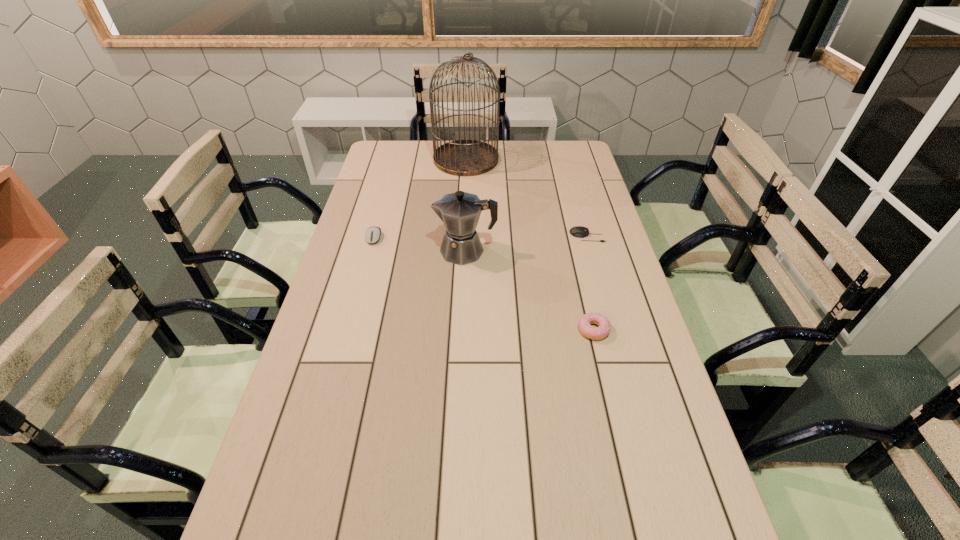
At what (x,y) coordinates should I click in order to perform the action: click on birdcage. Please return your answer as a coordinate pair (x, y). Looking at the image, I should click on (459, 157).

Identify the location of the farthest object. (459, 157).

Where is `coffeepot`? This screenshot has height=540, width=960. coffeepot is located at coordinates (460, 211).

In order to click on doughnut in this screenshot , I will do `click(595, 333)`.

Locate an element on the screen. The image size is (960, 540). the leftmost object is located at coordinates (372, 235).

Where is `the left mouse`? This screenshot has height=540, width=960. the left mouse is located at coordinates (372, 235).

Identify the location of the right mouse. Image resolution: width=960 pixels, height=540 pixels. (578, 231).

You are a GUI agent. You are given a task and a screenshot of the screen. Output one action in this format:
    pyautogui.click(x=<x>, y=<y>)
    Task: Click on the shortest object
    The height and width of the screenshot is (540, 960).
    Given the screenshot: What is the action you would take?
    pyautogui.click(x=578, y=231)

Locate an element on the screen. Image resolution: width=960 pixels, height=540 pixels. free space located 0.100m on the front of the birdcage is located at coordinates (465, 190).

You are a GUI agent. You are given a task and a screenshot of the screen. Output one action in this format:
    pyautogui.click(x=<x>, y=<y>)
    Task: Click on the vacant area situated at the spout of the coffeepot
    This screenshot has height=540, width=960.
    Given the screenshot: What is the action you would take?
    pyautogui.click(x=342, y=251)